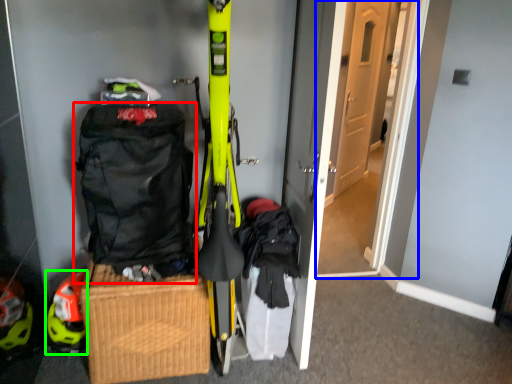
Question: Considering the real-world distances, which object is farthest from backpack (highlighted by a red box)? door (highlighted by a blue box) or helmet (highlighted by a green box)?

Choices:
 (A) door
 (B) helmet

Answer: (A)